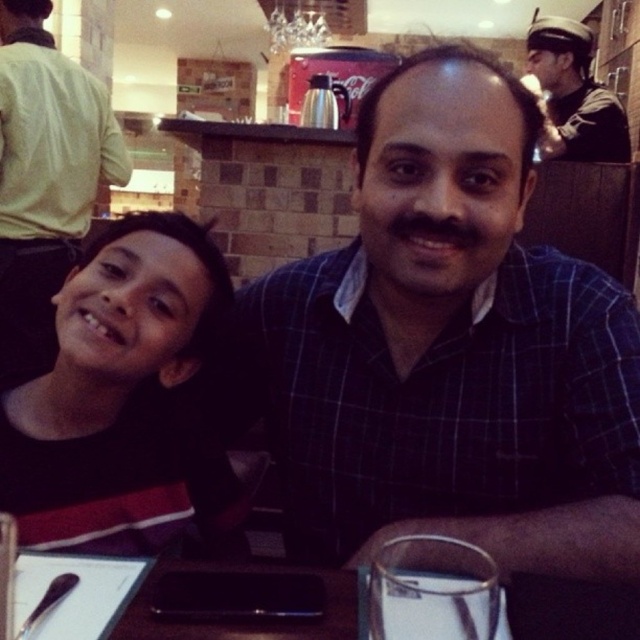
Looking at this image, does black fabric shirt at left have a greater width compared to dark blue uniform at upper right?

No.

This screenshot has width=640, height=640. What do you see at coordinates (120, 397) in the screenshot? I see `black fabric shirt at left` at bounding box center [120, 397].

I want to click on black fabric shirt at left, so click(x=120, y=397).

Find the location of a particular element. black fabric shirt at left is located at coordinates (120, 397).

The width and height of the screenshot is (640, 640). What do you see at coordinates (120, 397) in the screenshot?
I see `black fabric shirt at left` at bounding box center [120, 397].

Does black fabric shirt at left appear under matte black shirt at left?

Yes.

Is point (116, 532) in front of point (80, 179)?

Yes.

At what (x,y) coordinates should I click in order to perform the action: click on black fabric shirt at left. Please return your answer as a coordinate pair (x, y). The height and width of the screenshot is (640, 640). Looking at the image, I should click on (120, 397).

Who is positioned more to the left, blue checkered shirt at center or matte black shirt at left?

matte black shirt at left is more to the left.

Describe the element at coordinates (445, 349) in the screenshot. The image size is (640, 640). I see `blue checkered shirt at center` at that location.

Does point (276, 337) come in front of point (8, 225)?

That is True.

Image resolution: width=640 pixels, height=640 pixels. I want to click on blue checkered shirt at center, so click(445, 349).